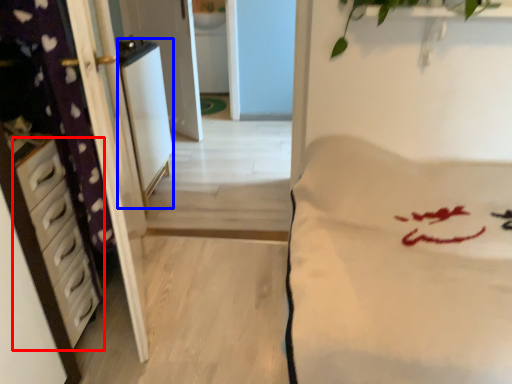
Question: Which object is closer to the camera taking this photo, chest of drawers (highlighted by a red box) or appliance (highlighted by a blue box)?

Choices:
 (A) chest of drawers
 (B) appliance

Answer: (A)